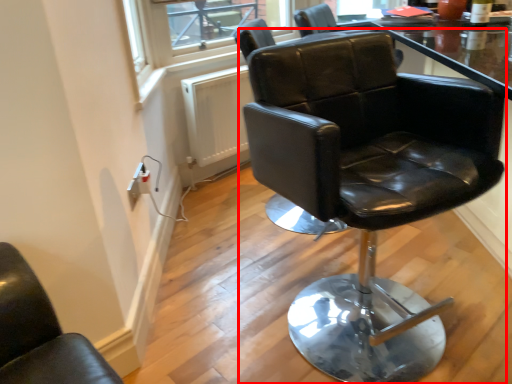
Question: Considering the relative positions of chair (annotated by the red box) and window screen in the image provided, where is chair (annotated by the red box) located with respect to the staircase?

Choices:
 (A) left
 (B) right

Answer: (B)